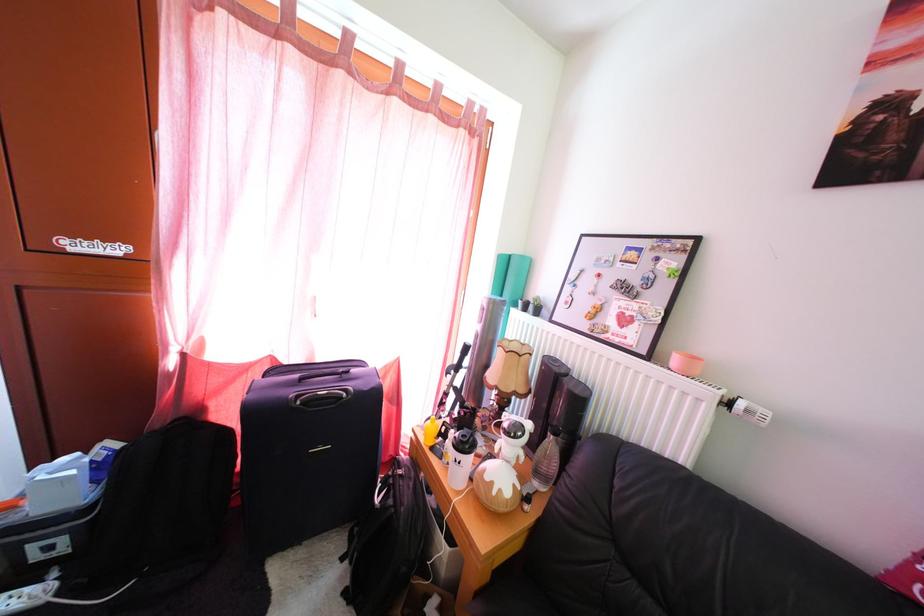
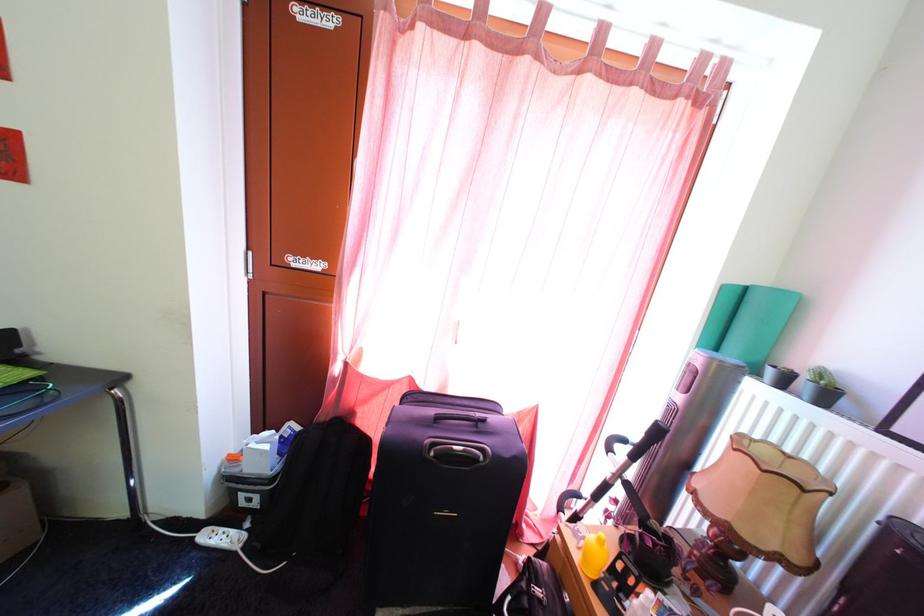
Where in the second image is the point corresponding to (x=540, y=315) from the first image?

(813, 395)